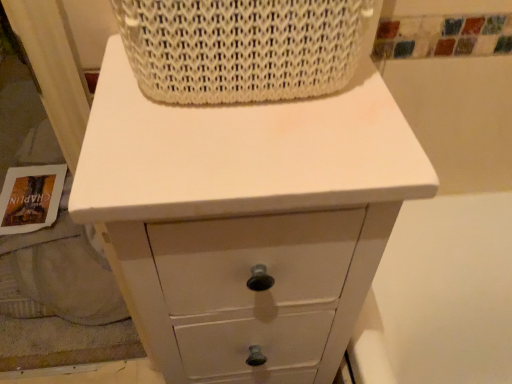
Locate an element on the screen. The image size is (512, 384). white woven basket at upper center is located at coordinates (243, 47).

Measure the distance between point (275, 17) and camera.

Point (275, 17) is 12.95 inches away from camera.

Describe the element at coordinates (243, 47) in the screenshot. I see `white woven basket at upper center` at that location.

The width and height of the screenshot is (512, 384). Describe the element at coordinates (245, 220) in the screenshot. I see `white matte chest of drawers at center` at that location.

Image resolution: width=512 pixels, height=384 pixels. I want to click on white matte chest of drawers at center, so click(x=245, y=220).

The width and height of the screenshot is (512, 384). In order to click on white woven basket at upper center in this screenshot , I will do `click(243, 47)`.

Which is more to the right, white matte chest of drawers at center or white woven basket at upper center?

white woven basket at upper center is more to the right.

Is white matte chest of drawers at center positioned before white woven basket at upper center?

No, it is behind white woven basket at upper center.

Does point (109, 250) come behind point (194, 78)?

Yes, it is.

From the image's perspective, is white matte chest of drawers at center located above or below white woven basket at upper center?

From the image's perspective, white matte chest of drawers at center appears below white woven basket at upper center.

From a real-world perspective, which object rests below the other?

From a 3D spatial view, white matte chest of drawers at center is below.

Which of these two, white matte chest of drawers at center or white woven basket at upper center, is wider?

white matte chest of drawers at center.

Between white matte chest of drawers at center and white woven basket at upper center, which one has less height?

With less height is white woven basket at upper center.

Between white matte chest of drawers at center and white woven basket at upper center, which one has larger size?

With larger size is white matte chest of drawers at center.

Looking at this image, is white matte chest of drawers at center outside of white woven basket at upper center?

Absolutely, white matte chest of drawers at center is external to white woven basket at upper center.

Is white matte chest of drawers at center positioned far away from white woven basket at upper center?

That's not correct — white matte chest of drawers at center is a little close to white woven basket at upper center.

Could you tell me if white matte chest of drawers at center is facing white woven basket at upper center?

No.

How different are the orientations of white matte chest of drawers at center and white woven basket at upper center in degrees?

The facing directions of white matte chest of drawers at center and white woven basket at upper center are 0.921 degrees apart.

This screenshot has width=512, height=384. I want to click on the chest of drawers that is below the white woven basket at upper center (from the image's perspective), so click(x=245, y=220).

Considering the relative positions of white woven basket at upper center and white matte chest of drawers at center in the image provided, is white woven basket at upper center to the right of white matte chest of drawers at center from the viewer's perspective?

Correct, you'll find white woven basket at upper center to the right of white matte chest of drawers at center.

Is the position of white woven basket at upper center less distant than that of white matte chest of drawers at center?

That is True.

Between point (142, 61) and point (209, 172), which one is positioned in front?

The point (209, 172) is more forward.

From the image's perspective, between white woven basket at upper center and white matte chest of drawers at center, who is located below?

From the image's view, white matte chest of drawers at center is below.

From a real-world perspective, does white woven basket at upper center sit lower than white matte chest of drawers at center?

No, from a real-world perspective, white woven basket at upper center is not beneath white matte chest of drawers at center.

Considering the relative sizes of white woven basket at upper center and white matte chest of drawers at center in the image provided, is white woven basket at upper center wider than white matte chest of drawers at center?

Incorrect, the width of white woven basket at upper center does not surpass that of white matte chest of drawers at center.

Can you confirm if white woven basket at upper center is shorter than white matte chest of drawers at center?

Correct, white woven basket at upper center is not as tall as white matte chest of drawers at center.

Considering the sizes of white woven basket at upper center and white matte chest of drawers at center in the image, is white woven basket at upper center bigger or smaller than white matte chest of drawers at center?

Clearly, white woven basket at upper center is smaller in size than white matte chest of drawers at center.

Is white matte chest of drawers at center a part of white woven basket at upper center?

No.

Would you consider white woven basket at upper center to be distant from white matte chest of drawers at center?

white woven basket at upper center is near white matte chest of drawers at center, not far away.

Is white woven basket at upper center positioned with its back to white matte chest of drawers at center?

No, white woven basket at upper center's orientation is not away from white matte chest of drawers at center.

Where is `basket above the white matte chest of drawers at center (from a real-world perspective)`? basket above the white matte chest of drawers at center (from a real-world perspective) is located at coordinates (243, 47).

Find the location of a particular element. the chest of drawers behind the white woven basket at upper center is located at coordinates [x=245, y=220].

The height and width of the screenshot is (384, 512). I want to click on chest of drawers on the left of white woven basket at upper center, so click(x=245, y=220).